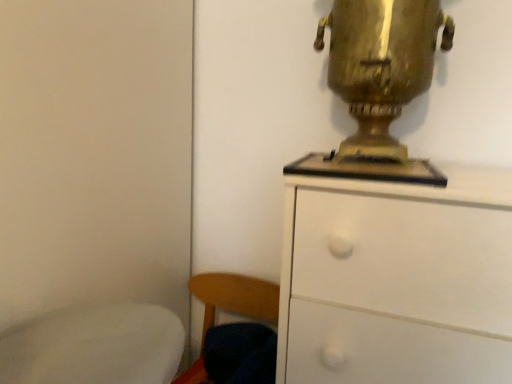
I want to click on free point below gold metallic samovar at upper right (from a real-world perspective), so click(367, 168).